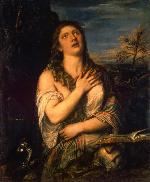
Identify the location of vase. (29, 151).